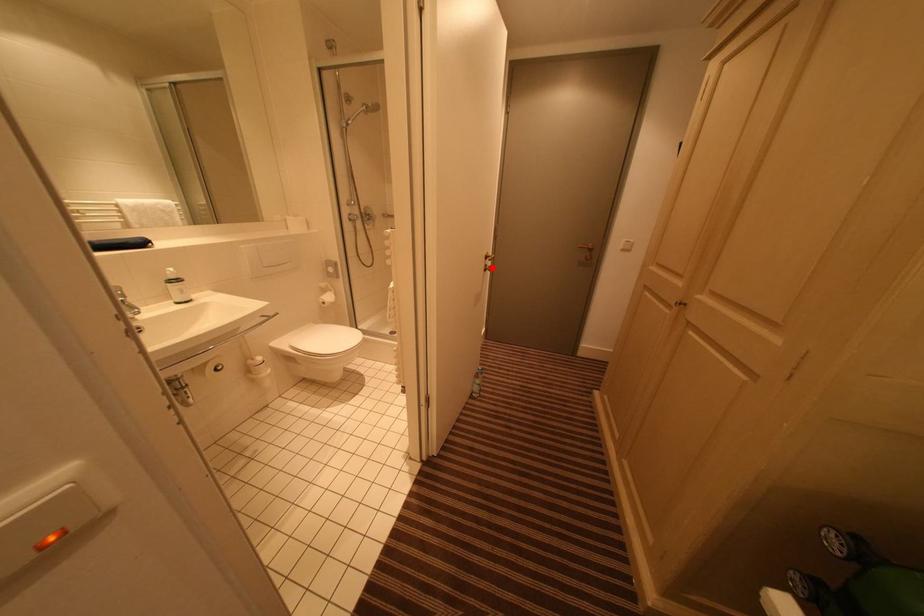
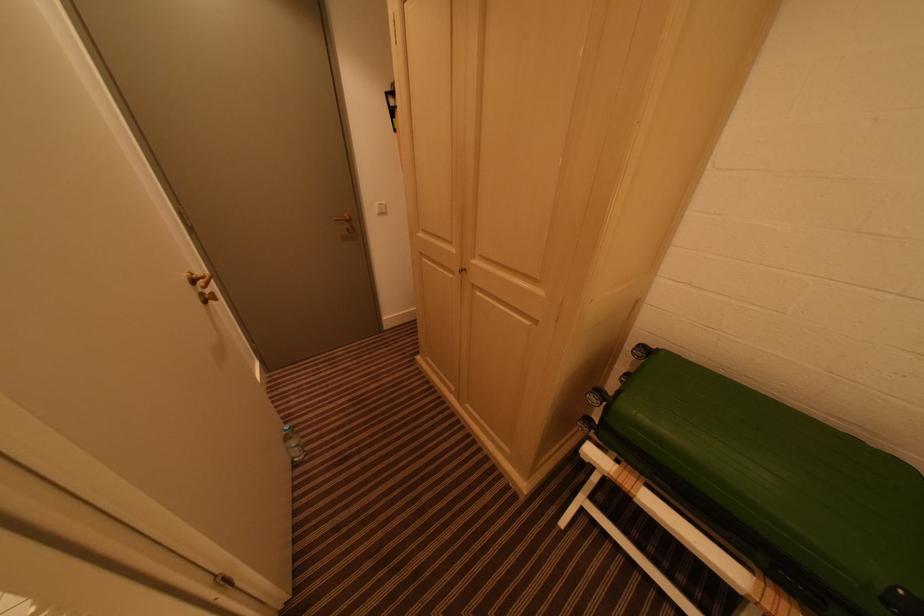
The point at the highlighted location is marked in the first image. Where is the corresponding point in the second image?

(208, 296)